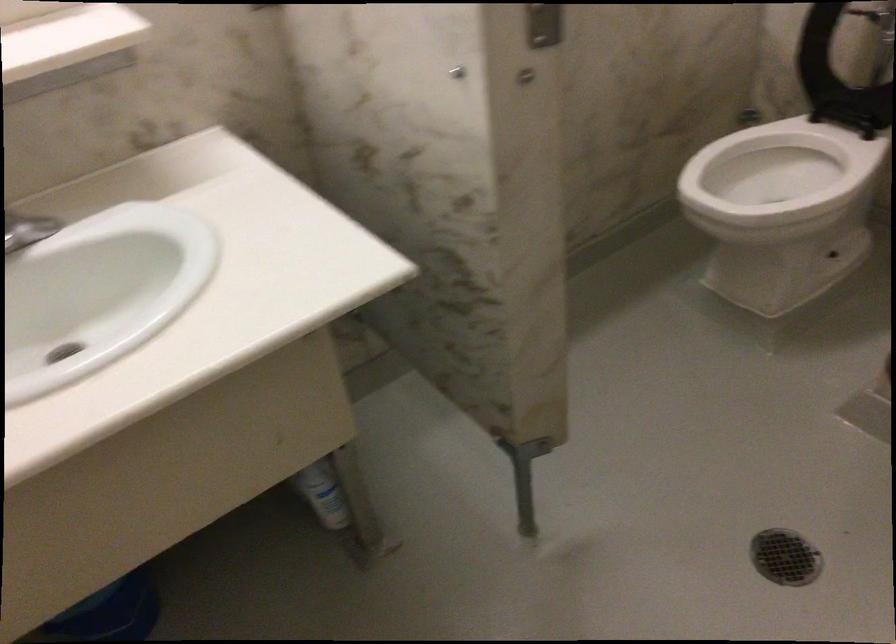
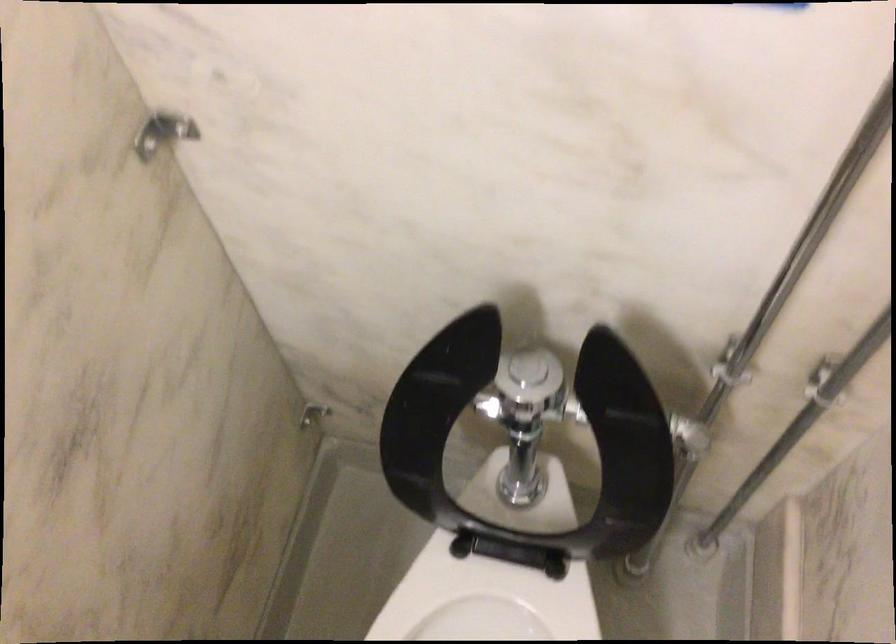
Find the pixel in the second image that matches the point at 803,167 in the first image.

(487, 605)